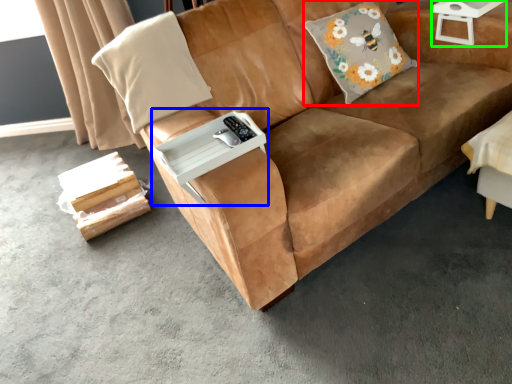
Question: Estimate the real-world distances between objects in this image. Which object is farther from throw pillow (highlighted by a red box), table (highlighted by a blue box) or side table (highlighted by a green box)?

Choices:
 (A) table
 (B) side table

Answer: (A)